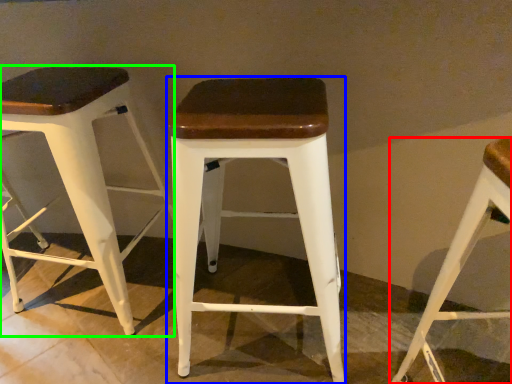
Question: Estimate the real-world distances between objects in this image. Which object is closer to stool (highlighted by a red box), stool (highlighted by a blue box) or stool (highlighted by a green box)?

Choices:
 (A) stool
 (B) stool

Answer: (A)